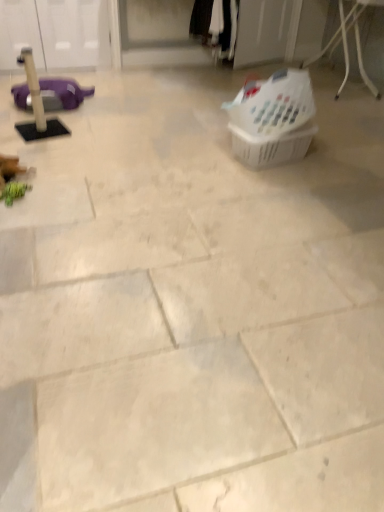
Find the location of a particular element. free space on the front side of translucent plastic basket at center-right, the first basket ordered from the bottom is located at coordinates (281, 183).